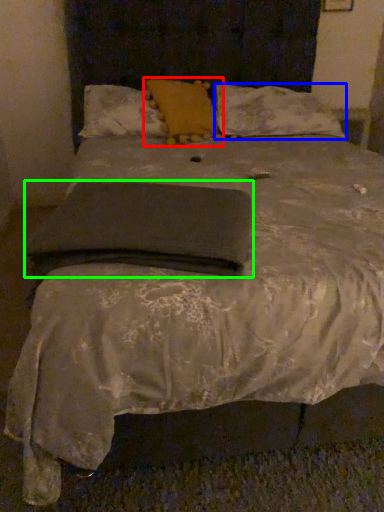
Question: Considering the real-world distances, which object is closest to pillow (highlighted by a red box)? pillow (highlighted by a blue box) or pad (highlighted by a green box).

Choices:
 (A) pillow
 (B) pad

Answer: (A)